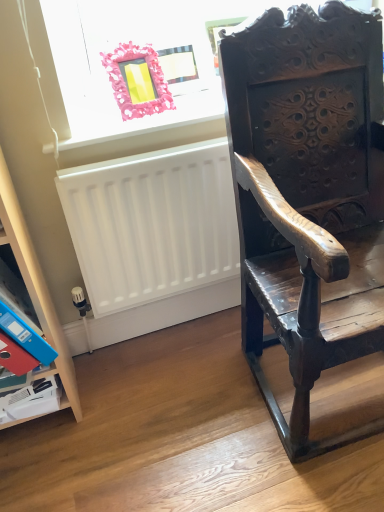
The image size is (384, 512). Find the location of `free space in front of pink fabric picture frame at upper left`. free space in front of pink fabric picture frame at upper left is located at coordinates (135, 119).